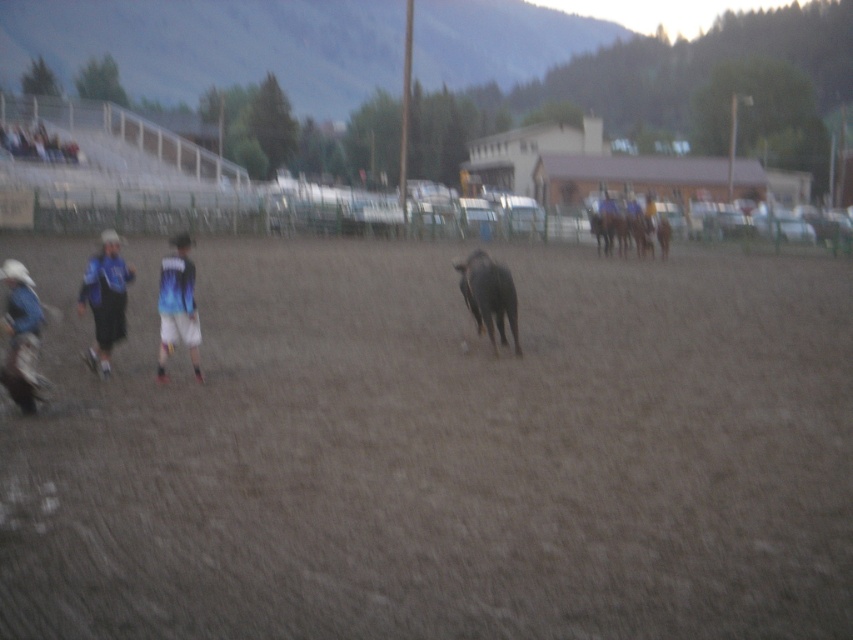
You are a photographer at the rodeo event. You want to take a photo of the blue jersey at left and the blue gradient jersey at center. Which jersey should you zoom in on to capture more details of the player wearing it?

The blue jersey at left is larger in size than the blue gradient jersey at center, so zooming in on the blue jersey at left will allow you to capture more details of the player wearing it.

You are a photographer at the rodeo event. You want to capture a photo where the blue gradient jersey at center and the black matte bull at center are both clearly visible. Based on their positions, which object should appear higher in the photo?

The blue gradient jersey at center is located above the black matte bull at center, so it should appear higher in the photo.

A rodeo participant needs to throw a lasso at the point marked at coordinates point (x=184, y=292). If they are standing at their current position, which is 32.84 feet away, is this distance within the typical lasso throwing range of 30 feet?

The distance between the participant and the point (x=184, y=292) is 32.84 feet, which exceeds the typical lasso throwing range of 30 feet. Therefore, the participant would be unable to reach the target with a standard lasso throw.